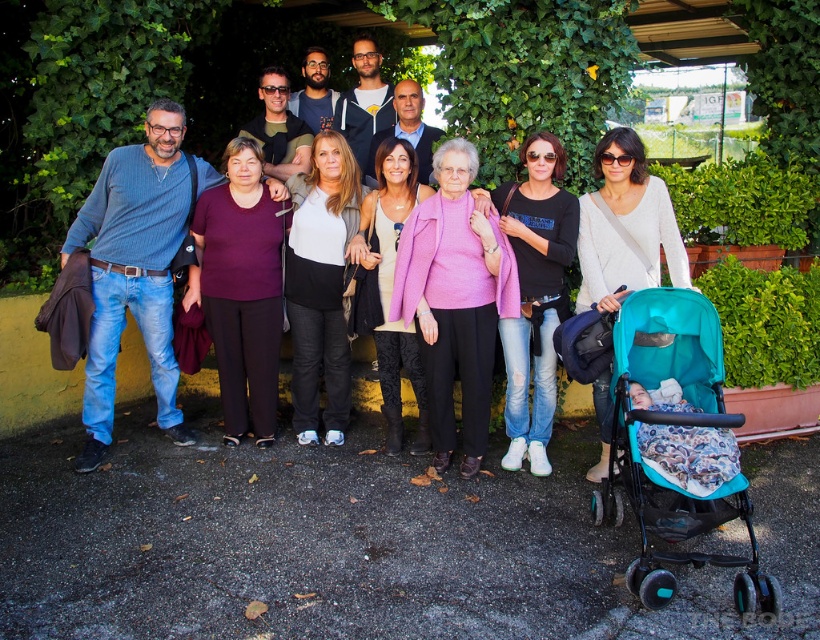
Question: Among these objects, which one is farthest from the camera?

Choices:
 (A) matte black stroller at lower right
 (B) teal fabric stroller at lower right

Answer: (A)

Question: Can you confirm if teal fabric stroller at lower right is thinner than matte black stroller at lower right?

Choices:
 (A) no
 (B) yes

Answer: (B)

Question: Is teal fabric stroller at lower right to the left of matte black stroller at lower right from the viewer's perspective?

Choices:
 (A) no
 (B) yes

Answer: (A)

Question: Which point is closer to the camera?

Choices:
 (A) teal fabric stroller at lower right
 (B) matte black stroller at lower right

Answer: (A)

Question: Can you confirm if teal fabric stroller at lower right is smaller than matte black stroller at lower right?

Choices:
 (A) no
 (B) yes

Answer: (B)